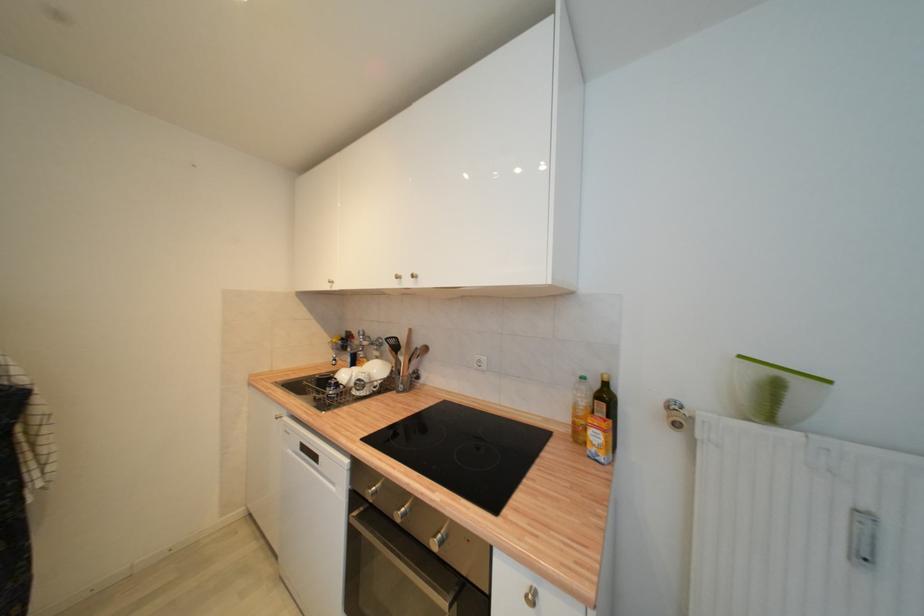
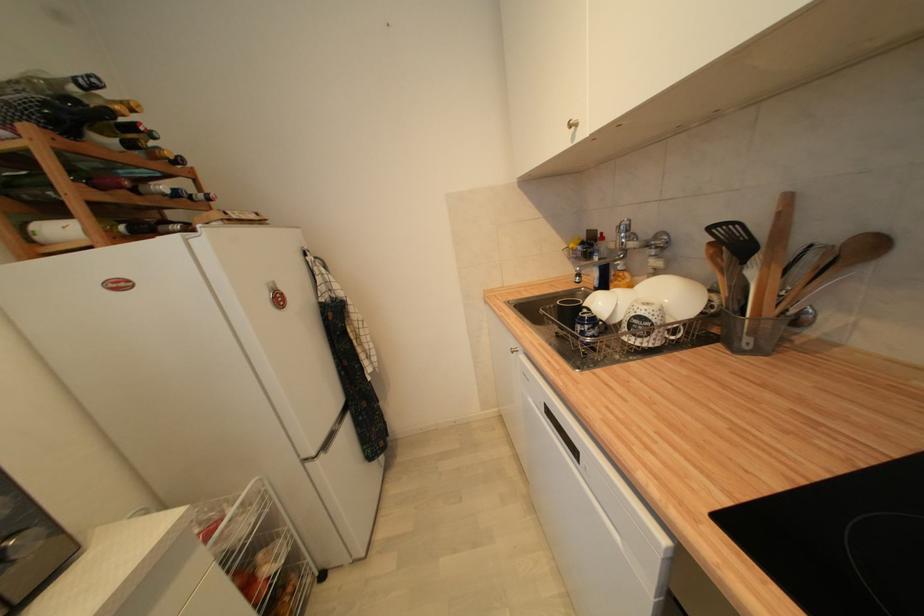
Locate, in the second image, the point that corresponds to the point at 411,376 in the first image.

(775, 314)